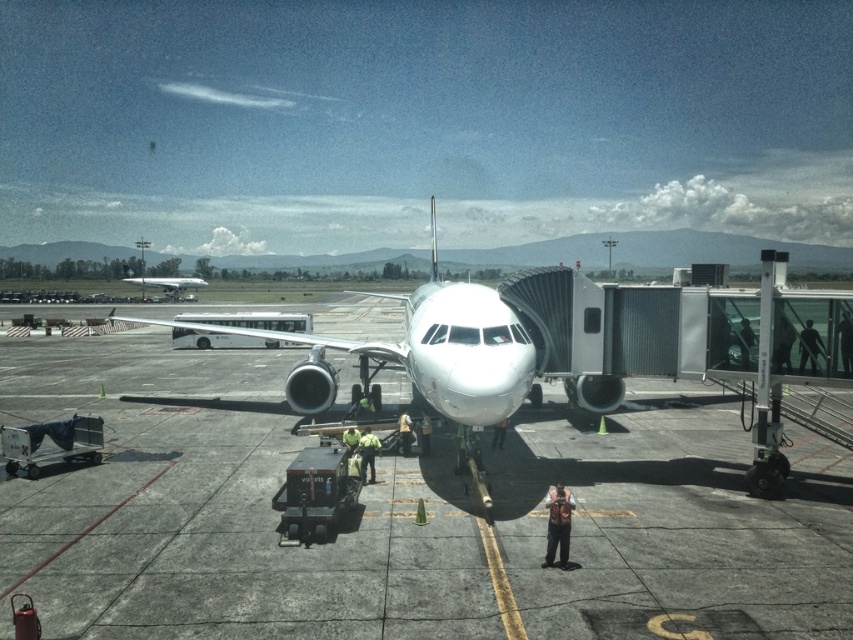
You are a pilot preparing to board passengers. You observe the metallic silver airplane at center and the silver metallic airplane at center from the jet bridge. Which airplane is taller?

The metallic silver airplane at center is taller than the silver metallic airplane at center according to the description.